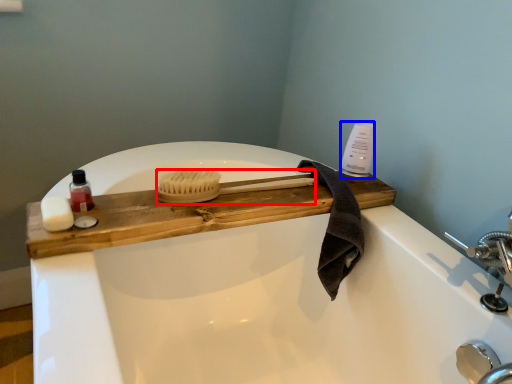
Question: Which of the following is the farthest to the observer, brush (highlighted by a red box) or cleaning product (highlighted by a blue box)?

Choices:
 (A) brush
 (B) cleaning product

Answer: (B)